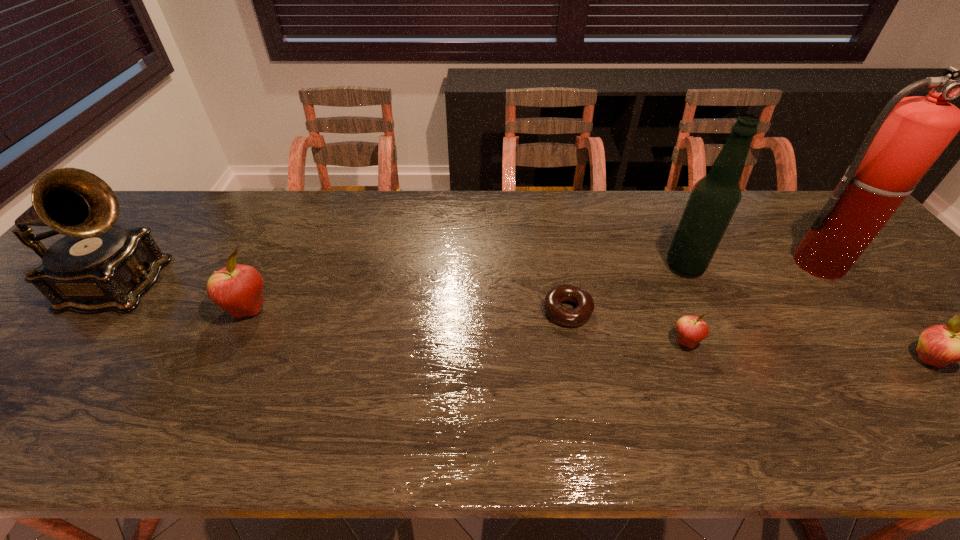
If the aim is uniform spacing by inserting an additional apple among them, please point to a vacant space for this new apple. Please provide its 2D coordinates. Your answer should be formatted as a tuple, i.e. [(x, y)], where the tuple contains the x and y coordinates of a point satisfying the conditions above.

[(460, 325)]